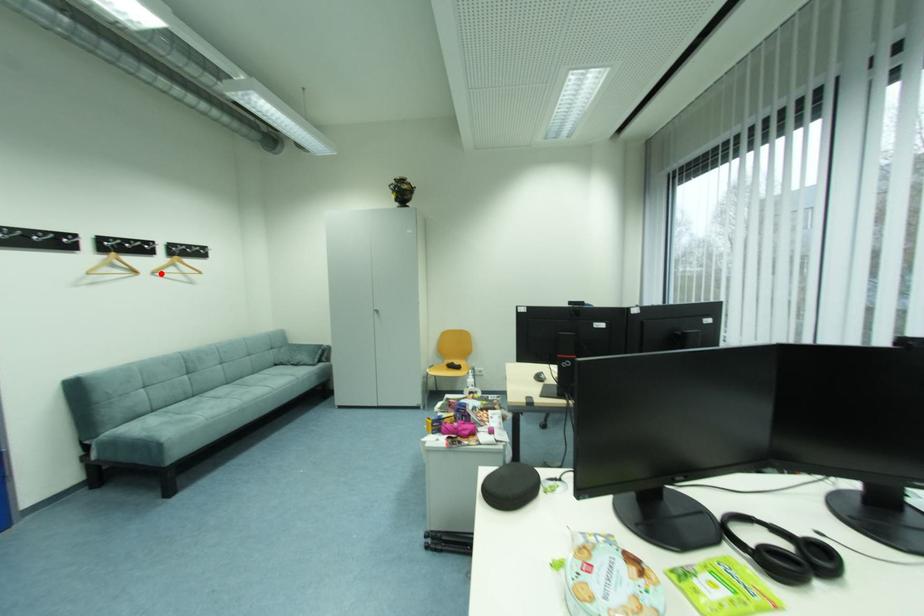
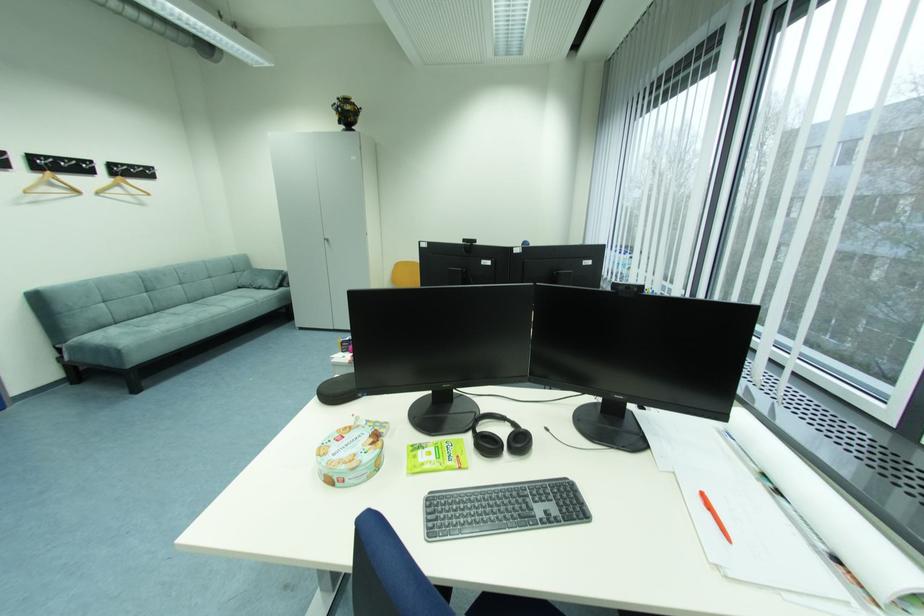
In the second image, find the point that corresponds to the highlighted location in the first image.

(104, 193)